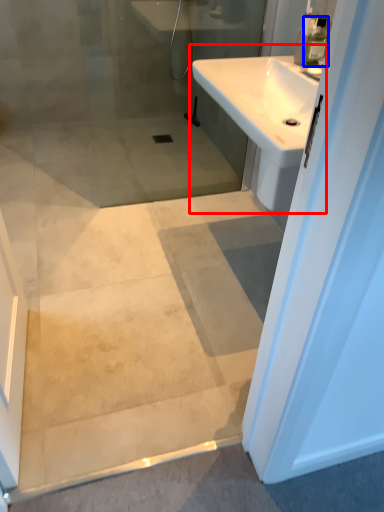
Question: Which object appears farthest to the camera in this image, sink (highlighted by a red box) or toiletry (highlighted by a blue box)?

Choices:
 (A) sink
 (B) toiletry

Answer: (B)